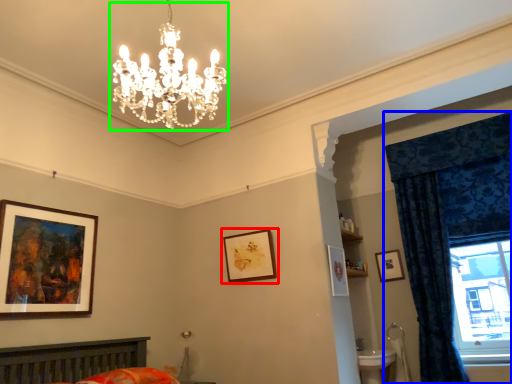
Question: Considering the real-world distances, which object is closest to picture frame (highlighted by a red box)? curtain (highlighted by a blue box) or light fixture (highlighted by a green box).

Choices:
 (A) curtain
 (B) light fixture

Answer: (B)